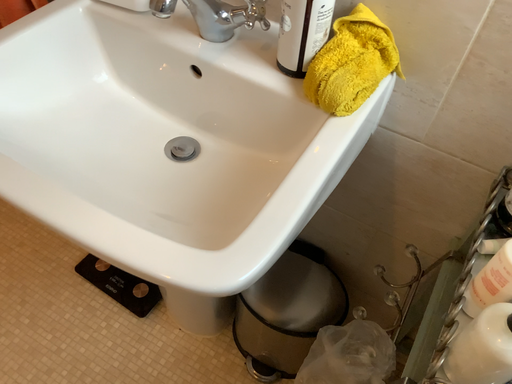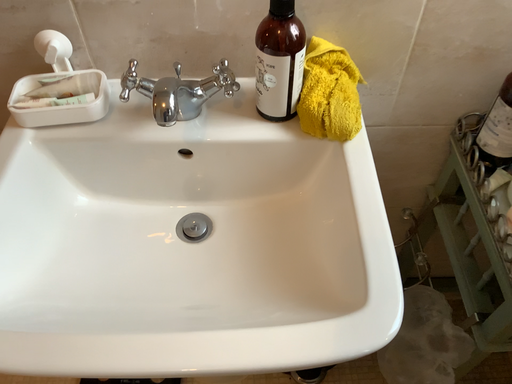
Question: Which way did the camera rotate in the video?

Choices:
 (A) rotated left
 (B) rotated right

Answer: (B)